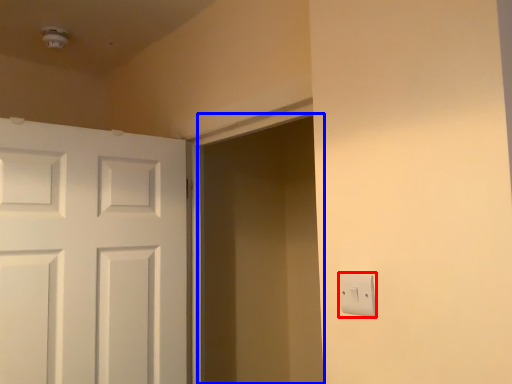
Question: Which of the following is the farthest to the observer, light switch (highlighted by a red box) or screen door (highlighted by a blue box)?

Choices:
 (A) light switch
 (B) screen door

Answer: (B)